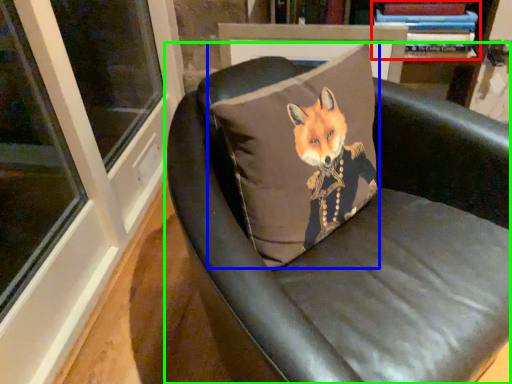
Question: Based on their relative distances, which object is nearer to book (highlighted by a red box)? Choose from pillow (highlighted by a blue box) and chair (highlighted by a green box).

Choices:
 (A) pillow
 (B) chair

Answer: (A)